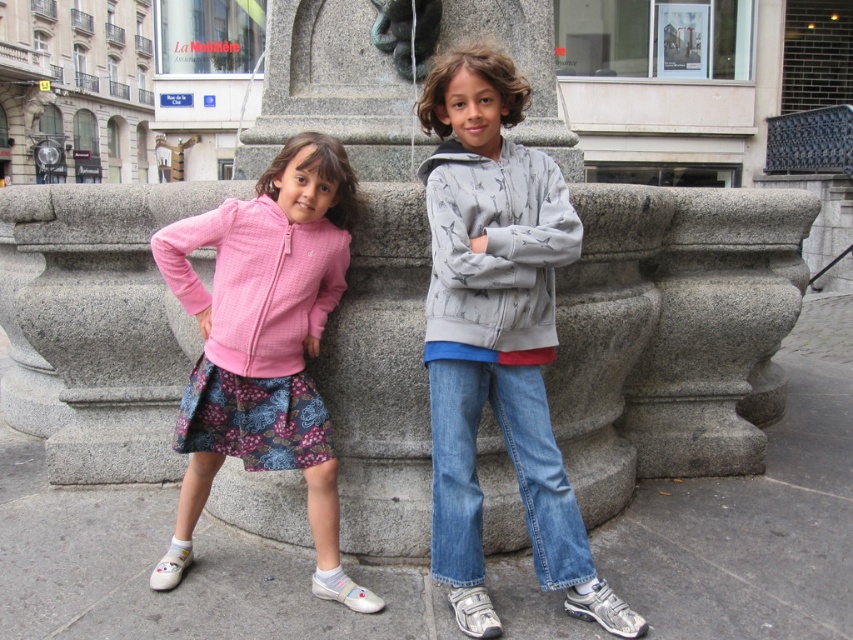
You are a photographer trying to capture the exact position of the pink fleece jacket at center in the image. What are the coordinates of this jacket?

The coordinates of the pink fleece jacket at center are at point (264, 344).

You are a photographer setting up for a group photo. You need to ensure that the two children wearing the pink fleece jacket at center and the gray cotton sweatshirt at center are positioned so that there is at least 30 inches between them. Based on the current spacing, will you need to adjust their positions?

The distance between the pink fleece jacket at center and the gray cotton sweatshirt at center is 28.51 inches. Since this is less than the required 30 inches, you will need to move them further apart to meet the spacing requirement.

You are a fashion designer observing two children wearing sweatshirts in the image. The children are standing in front of a stone fountain. Which sweatshirt, the gray cotton sweatshirt at center or the matte pink sweatshirt at left, would you say is bigger in size?

The gray cotton sweatshirt at center is larger in size than the matte pink sweatshirt at left.